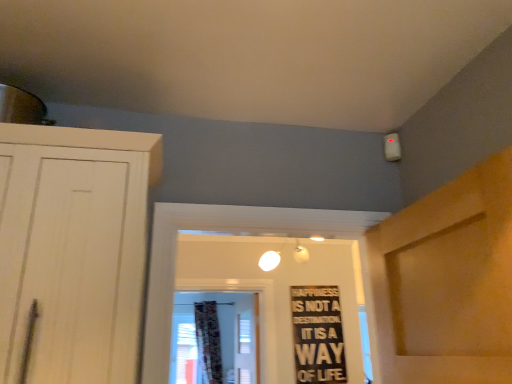
Question: Does black matte signboard at center have a lesser height compared to floral fabric curtain at center?

Choices:
 (A) no
 (B) yes

Answer: (B)

Question: Is the position of black matte signboard at center less distant than that of floral fabric curtain at center?

Choices:
 (A) no
 (B) yes

Answer: (B)

Question: From the image's perspective, is black matte signboard at center under floral fabric curtain at center?

Choices:
 (A) yes
 (B) no

Answer: (B)

Question: Is black matte signboard at center thinner than floral fabric curtain at center?

Choices:
 (A) yes
 (B) no

Answer: (A)

Question: Is black matte signboard at center with floral fabric curtain at center?

Choices:
 (A) yes
 (B) no

Answer: (B)

Question: Does black matte signboard at center have a larger size compared to floral fabric curtain at center?

Choices:
 (A) yes
 (B) no

Answer: (B)

Question: Is floral fabric curtain at center positioned in front of black matte signboard at center?

Choices:
 (A) no
 (B) yes

Answer: (A)

Question: Is black matte signboard at center at the back of floral fabric curtain at center?

Choices:
 (A) yes
 (B) no

Answer: (B)

Question: From the image's perspective, would you say floral fabric curtain at center is shown under black matte signboard at center?

Choices:
 (A) no
 (B) yes

Answer: (B)

Question: Is floral fabric curtain at center thinner than black matte signboard at center?

Choices:
 (A) yes
 (B) no

Answer: (B)

Question: Is floral fabric curtain at center not close to black matte signboard at center?

Choices:
 (A) no
 (B) yes

Answer: (B)

Question: Is floral fabric curtain at center outside black matte signboard at center?

Choices:
 (A) yes
 (B) no

Answer: (A)

Question: Which is correct: black matte signboard at center is inside floral fabric curtain at center, or outside of it?

Choices:
 (A) outside
 (B) inside

Answer: (A)